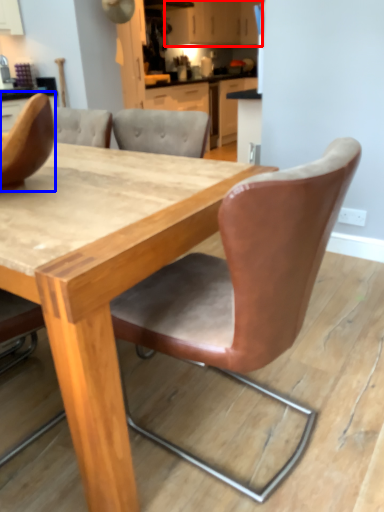
Question: Which object appears closest to the camera in this image, cabinetry (highlighted by a red box) or chair (highlighted by a blue box)?

Choices:
 (A) cabinetry
 (B) chair

Answer: (B)